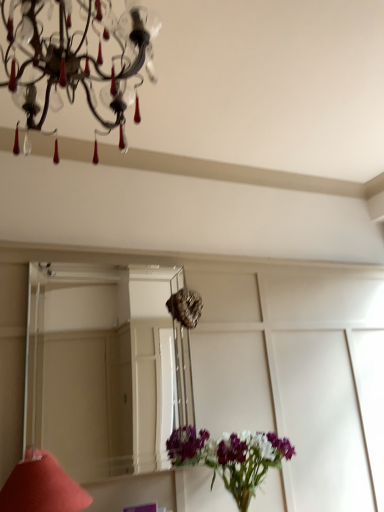
Question: Is matte red cone at lower left behind crystal glass chandelier at upper left?

Choices:
 (A) no
 (B) yes

Answer: (B)

Question: From the image's perspective, would you say matte red cone at lower left is positioned over crystal glass chandelier at upper left?

Choices:
 (A) yes
 (B) no

Answer: (B)

Question: Considering the relative sizes of matte red cone at lower left and crystal glass chandelier at upper left in the image provided, is matte red cone at lower left taller than crystal glass chandelier at upper left?

Choices:
 (A) no
 (B) yes

Answer: (A)

Question: Does matte red cone at lower left appear on the left side of crystal glass chandelier at upper left?

Choices:
 (A) no
 (B) yes

Answer: (B)

Question: Is matte red cone at lower left closer to camera compared to crystal glass chandelier at upper left?

Choices:
 (A) yes
 (B) no

Answer: (B)

Question: From the image's perspective, does matte red cone at lower left appear lower than crystal glass chandelier at upper left?

Choices:
 (A) no
 (B) yes

Answer: (B)

Question: Does clear glass mirror at center have a lesser width compared to matte red cone at lower left?

Choices:
 (A) no
 (B) yes

Answer: (B)

Question: Is clear glass mirror at center positioned far away from matte red cone at lower left?

Choices:
 (A) no
 (B) yes

Answer: (B)

Question: From a real-world perspective, does clear glass mirror at center stand above matte red cone at lower left?

Choices:
 (A) yes
 (B) no

Answer: (A)

Question: From a real-world perspective, is clear glass mirror at center under matte red cone at lower left?

Choices:
 (A) no
 (B) yes

Answer: (A)

Question: Is clear glass mirror at center positioned with its back to matte red cone at lower left?

Choices:
 (A) yes
 (B) no

Answer: (B)

Question: From the image's perspective, would you say clear glass mirror at center is positioned over matte red cone at lower left?

Choices:
 (A) no
 (B) yes

Answer: (B)

Question: Is crystal glass chandelier at upper left smaller than clear glass mirror at center?

Choices:
 (A) no
 (B) yes

Answer: (A)